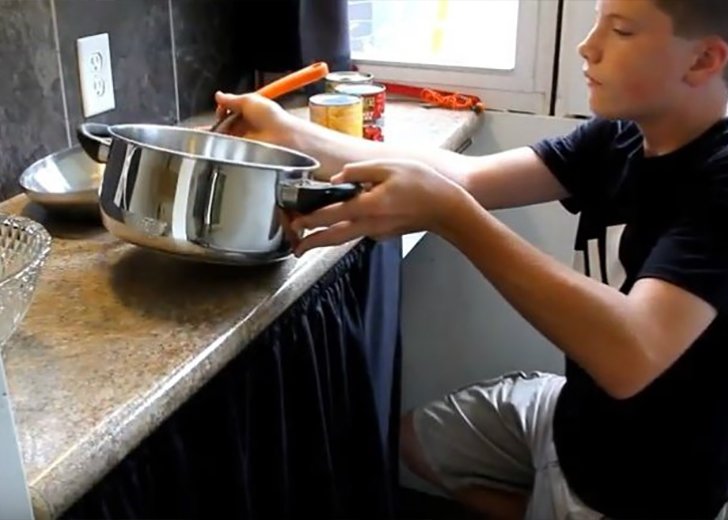
I want to click on background window, so click(x=470, y=38).